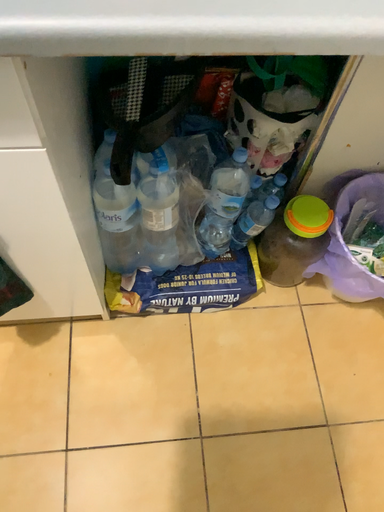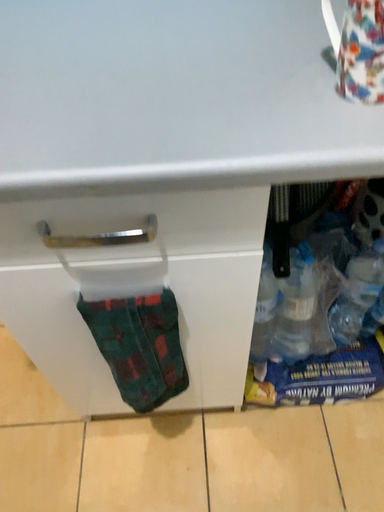
Question: How did the camera likely rotate when shooting the video?

Choices:
 (A) rotated downward
 (B) rotated upward

Answer: (B)